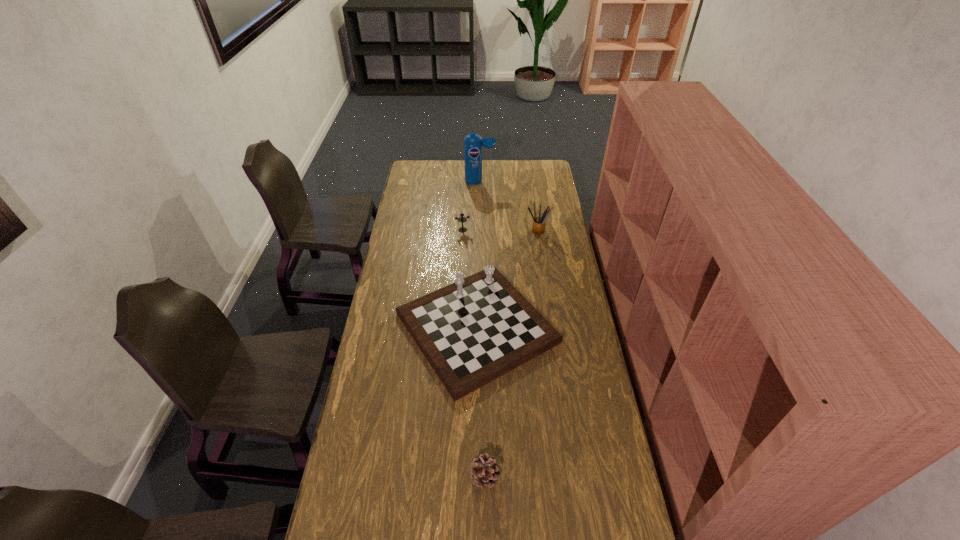
Where is `blank region between the gameboard and the pencil box`? Image resolution: width=960 pixels, height=540 pixels. blank region between the gameboard and the pencil box is located at coordinates (507, 279).

Image resolution: width=960 pixels, height=540 pixels. What are the coordinates of `the fourth closest object to the tallest object` in the screenshot? It's located at (484, 469).

The height and width of the screenshot is (540, 960). What are the coordinates of `object that is the third closest one to the nearest object` in the screenshot? It's located at (462, 219).

Identify the location of vacant area in the image that satisfies the following two spatial constraints: 1. on the front side of the pencil box; 2. on the right side of the second shortest object. (463, 231).